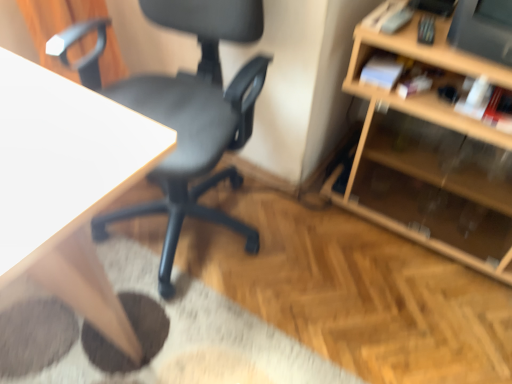
This screenshot has height=384, width=512. Identify the location of vacant region to the left of wooden shelf at right. (313, 243).